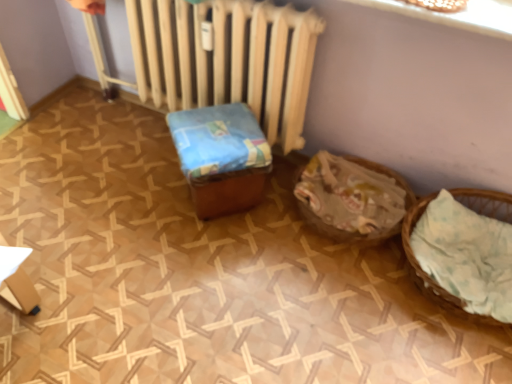
Question: From a real-world perspective, relative to blue fabric-covered box at center, is light brown woven basket at right, arranged as the 1th basket when viewed from the right, vertically above or below?

Choices:
 (A) above
 (B) below

Answer: (B)

Question: Relative to blue fabric-covered box at center, is light brown woven basket at right, arranged as the 1th basket when viewed from the right, in front or behind?

Choices:
 (A) behind
 (B) front

Answer: (B)

Question: Which object is the closest to the blue fabric-covered box at center?

Choices:
 (A) brown woven basket at lower right, the second basket positioned from the right
 (B) white matte radiator at center
 (C) light brown woven basket at right, arranged as the 1th basket when viewed from the right

Answer: (B)

Question: Considering the real-world distances, which object is closest to the blue fabric-covered box at center?

Choices:
 (A) light brown woven basket at right, arranged as the 1th basket when viewed from the right
 (B) brown woven basket at lower right, the second basket positioned from the right
 (C) white matte radiator at center

Answer: (C)